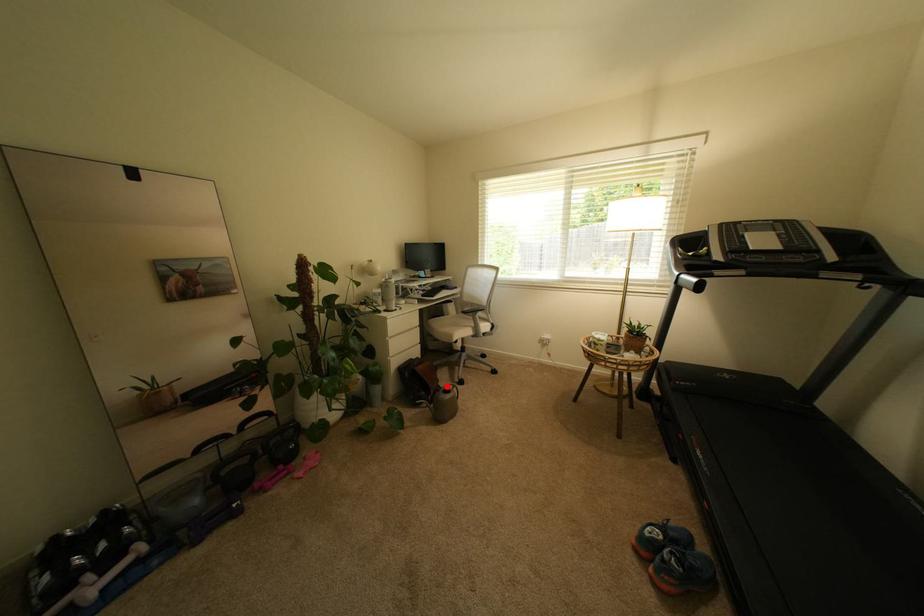
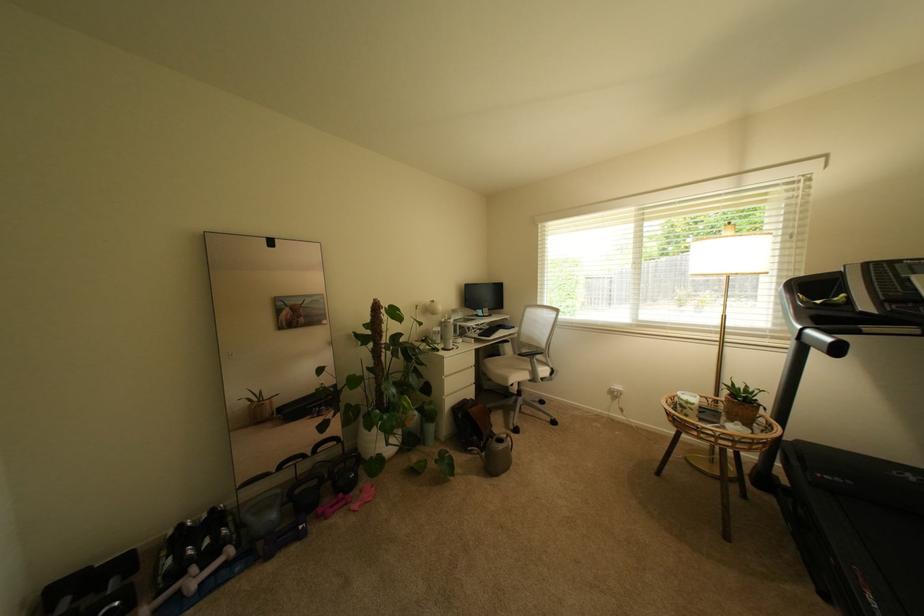
Question: I am providing you with two images of the same scene from different viewpoints. In image1, a red point is highlighted. Considering the same 3D point in image2, which of the following is correct?

Choices:
 (A) It is closer
 (B) It is farther

Answer: (B)